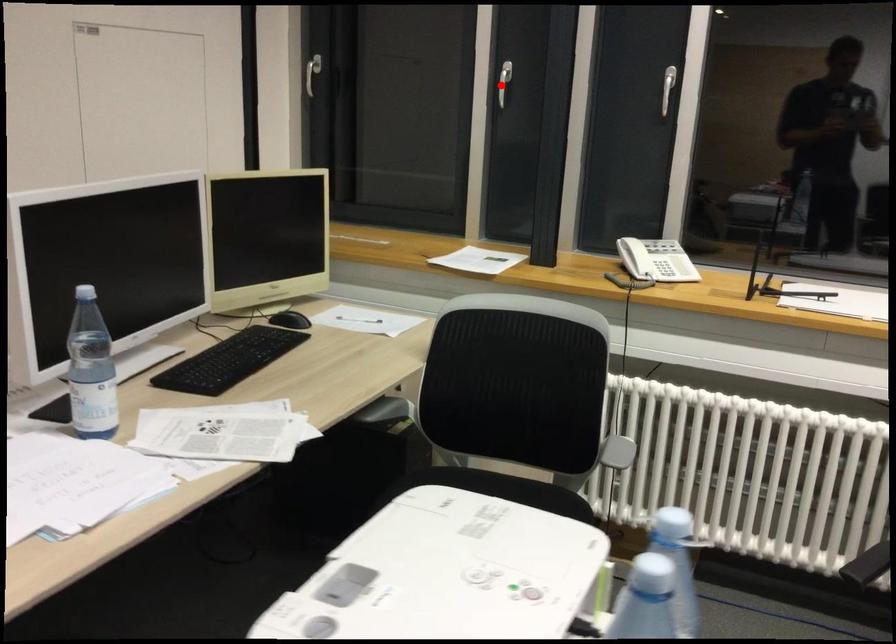
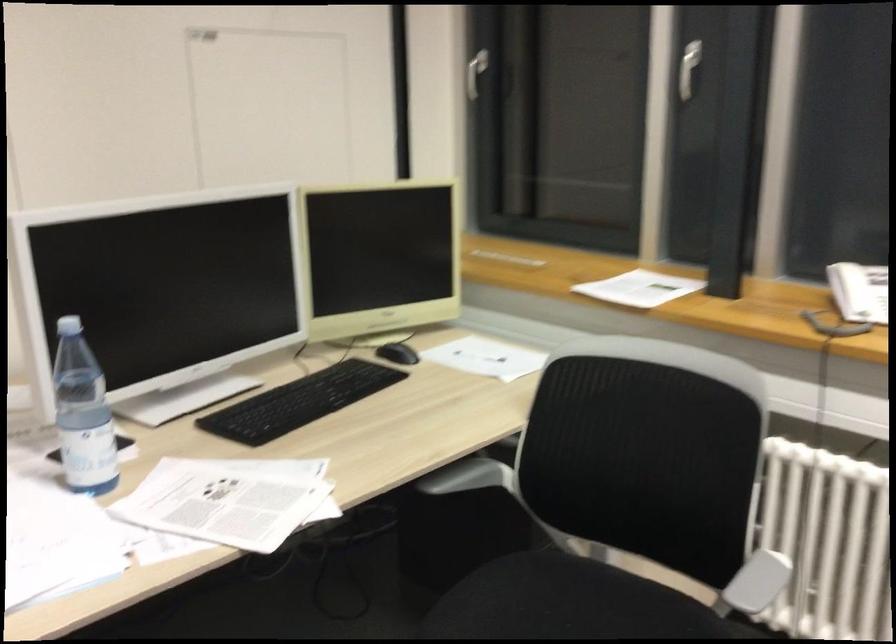
Question: I am providing you with two images of the same scene from different viewpoints. A red point is shown in image1. For the corresponding object point in image2, is it positioned nearer or farther from the camera?

Choices:
 (A) Nearer
 (B) Farther

Answer: (A)